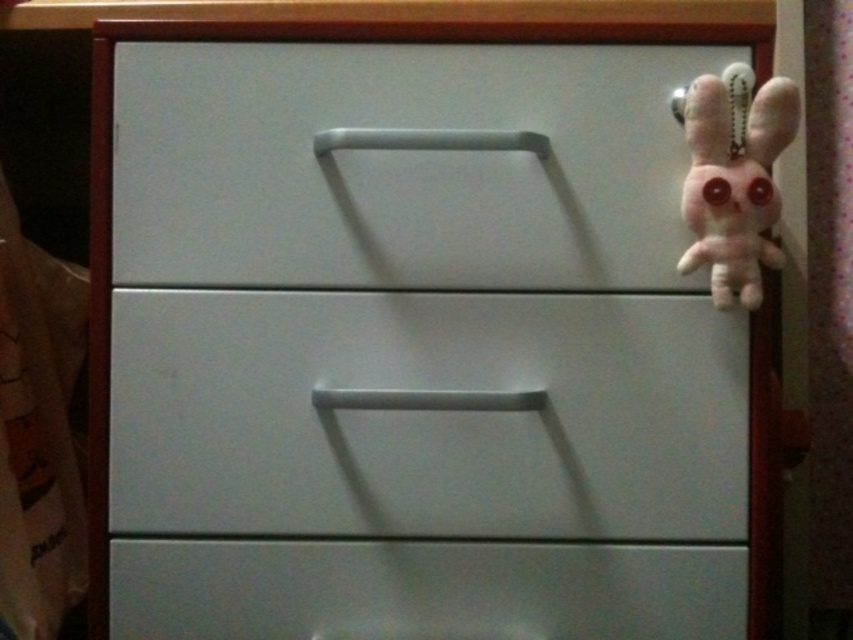
Is point (117, 410) in front of point (763, 168)?

That is False.

Is white matte drawer at center further to camera compared to fluffy pink plush at upper right?

Yes, it is behind fluffy pink plush at upper right.

What do you see at coordinates (427, 416) in the screenshot? I see `white matte drawer at center` at bounding box center [427, 416].

The image size is (853, 640). What are the coordinates of `white matte drawer at center` in the screenshot? It's located at (427, 416).

This screenshot has width=853, height=640. Describe the element at coordinates (427, 416) in the screenshot. I see `white matte drawer at center` at that location.

Between point (363, 320) and point (456, 157), which one is positioned in front?

Point (456, 157) is more forward.

Who is more distant from viewer, (x=230, y=342) or (x=669, y=243)?

The point (x=230, y=342) is behind.

Find the location of a particular element. This screenshot has width=853, height=640. white matte drawer at center is located at coordinates (427, 416).

The image size is (853, 640). In order to click on white matte drawer at center in this screenshot , I will do `click(427, 416)`.

At what (x,y) coordinates should I click in order to perform the action: click on white matte drawer at center. Please return your answer as a coordinate pair (x, y). Looking at the image, I should click on (427, 416).